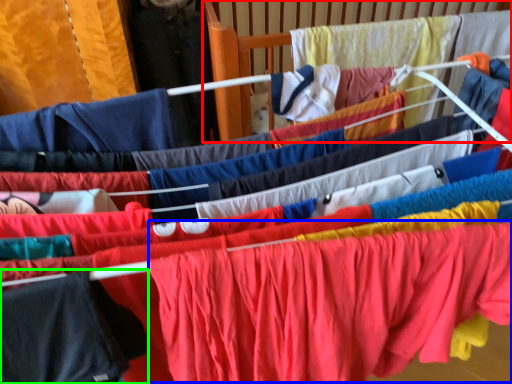
Question: Which object is the closest to the infant bed (highlighted by a red box)? Choose among these: clothing (highlighted by a blue box) or clothing (highlighted by a green box).

Choices:
 (A) clothing
 (B) clothing

Answer: (A)